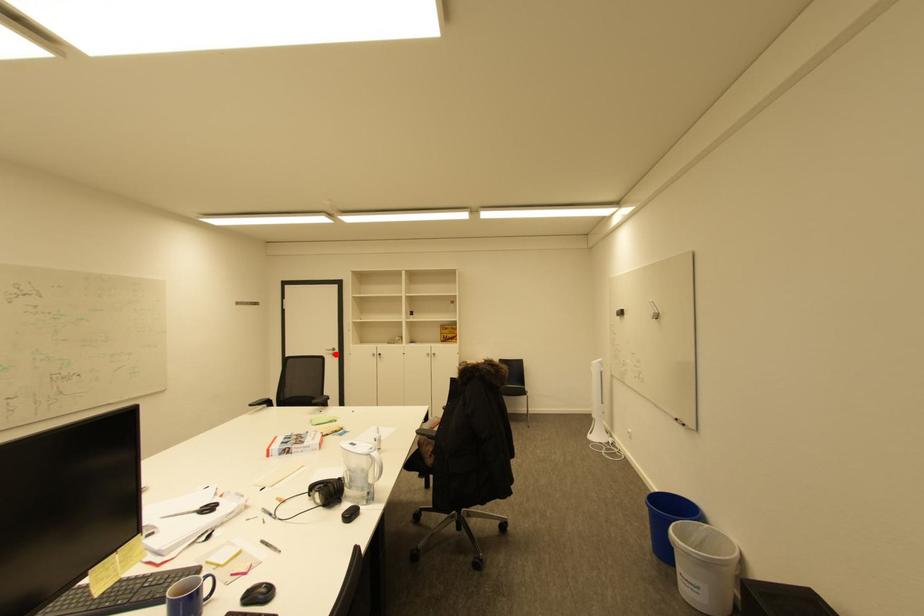
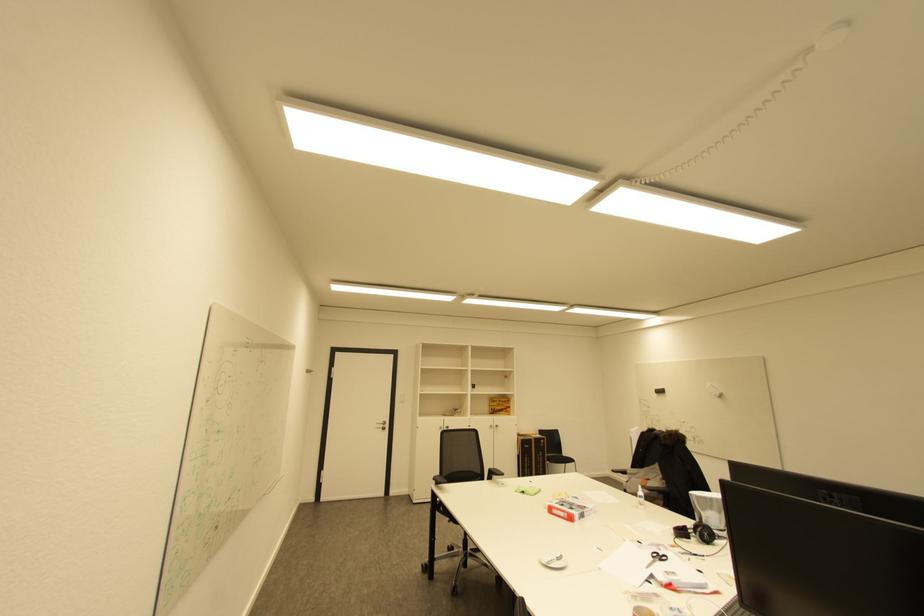
The point at the highlighted location is marked in the first image. Where is the corresponding point in the second image?

(385, 429)